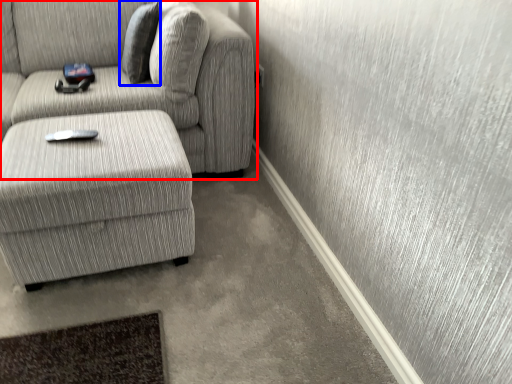
Question: Which of the following is the farthest to the observer, studio couch (highlighted by a red box) or pillow (highlighted by a blue box)?

Choices:
 (A) studio couch
 (B) pillow

Answer: (B)